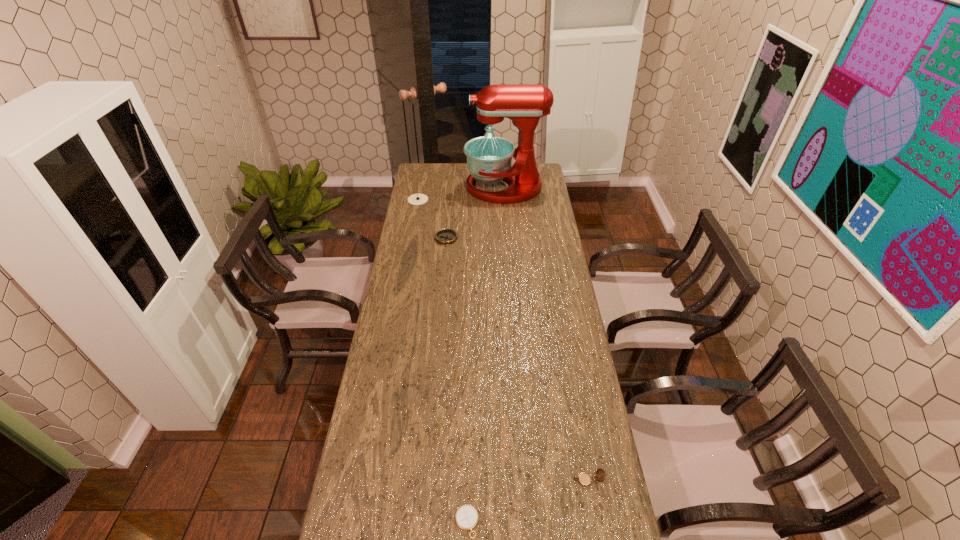
Find the location of a particular element. the tallest object is located at coordinates (489, 158).

I want to click on the farthest compass, so click(x=416, y=199).

Identify the location of the leftmost object. (416, 199).

The width and height of the screenshot is (960, 540). Find the location of `the third shortest object`. the third shortest object is located at coordinates pyautogui.click(x=584, y=479).

Image resolution: width=960 pixels, height=540 pixels. Identify the location of the fourth farthest object. (584, 479).

Locate an element on the screen. the second shortest object is located at coordinates (446, 236).

Where is `the second compass from left to right`? the second compass from left to right is located at coordinates point(446,236).

At what (x,y) coordinates should I click in order to perform the action: click on the nearest compass. Please return your answer as a coordinate pair (x, y). Looking at the image, I should click on (466, 517).

You are a GUI agent. You are given a task and a screenshot of the screen. Output one action in this format:
    pyautogui.click(x=<x>, y=<y>)
    Task: Click on the second compass from right to left
    The image size is (960, 540).
    Given the screenshot: What is the action you would take?
    pyautogui.click(x=466, y=517)

Where is `free space located 0.150m on the front-facing side of the tallest object`? Image resolution: width=960 pixels, height=540 pixels. free space located 0.150m on the front-facing side of the tallest object is located at coordinates (437, 187).